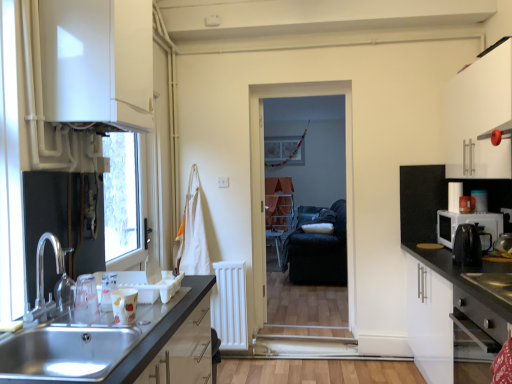
Question: From the image's perspective, is black fabric armchair at center above or below white glossy cabinet at upper left, which ranks as the first cabinetry in left-to-right order?

Choices:
 (A) above
 (B) below

Answer: (B)

Question: Considering the positions of black fabric armchair at center and white glossy cabinet at upper left, which ranks as the first cabinetry in left-to-right order, in the image, is black fabric armchair at center wider or thinner than white glossy cabinet at upper left, which ranks as the first cabinetry in left-to-right order,?

Choices:
 (A) thin
 (B) wide

Answer: (B)

Question: Which of these objects is positioned closest to the black fabric screen door at center?

Choices:
 (A) black plastic coffee machine at right
 (B) white matte cabinet at right, which ranks as the second cabinetry in right-to-left order
 (C) black stainless steel gas stove at lower right
 (D) black plastic kettle at right, the second appliance from the back
 (E) white glossy cabinet at upper left, which is the 3th cabinetry in right-to-left order

Answer: (B)

Question: Estimate the real-world distances between objects in this image. Which object is closer to the matte black countertop at lower left?

Choices:
 (A) stainless steel oven at lower right
 (B) black plastic kettle at right, the second appliance from the front
 (C) white matte cabinet at upper right, the first cabinetry viewed from the right
 (D) wooden table at center
 (E) white glossy cabinet at upper left, which ranks as the first cabinetry in left-to-right order

Answer: (E)